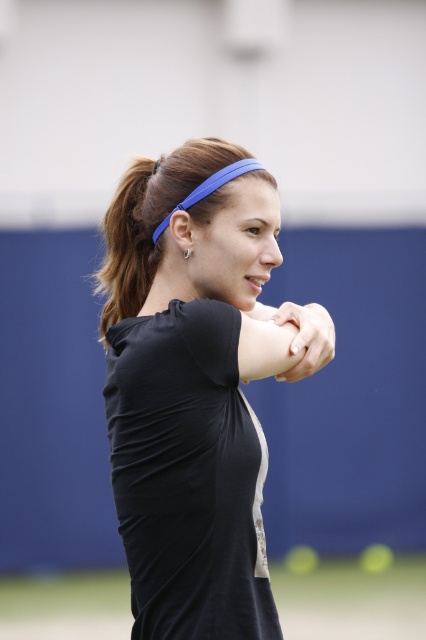
You are a photographer setting up for a portrait shoot. You notice the black matte headband at center and the brown hair at upper left in the frame. Based on their positions, which object would appear closer to the camera?

The black matte headband at center is taller than the brown hair at upper left, so it appears closer to the camera.

The woman in the scene is wearing a black matte headband at center and has smooth skin at center. Which object is taller?

The black matte headband at center is much taller than the smooth skin at center.